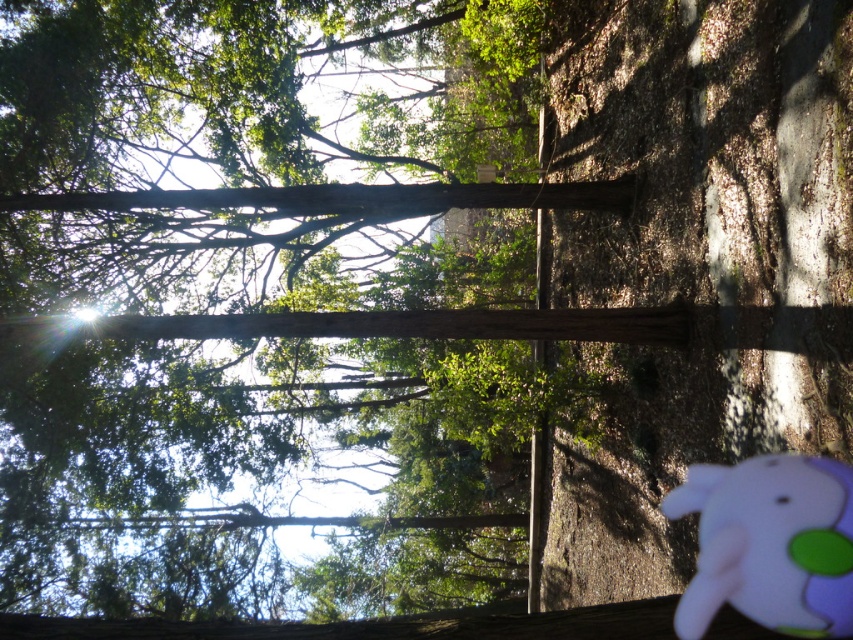
You are standing in the middle of a forest and see two points in the scene. The first point is at coordinate point (115, 172) and the second is at point (729, 600). Which point is closer to you?

Point (115, 172) is closer to you because it is further to the viewer than point (729, 600).